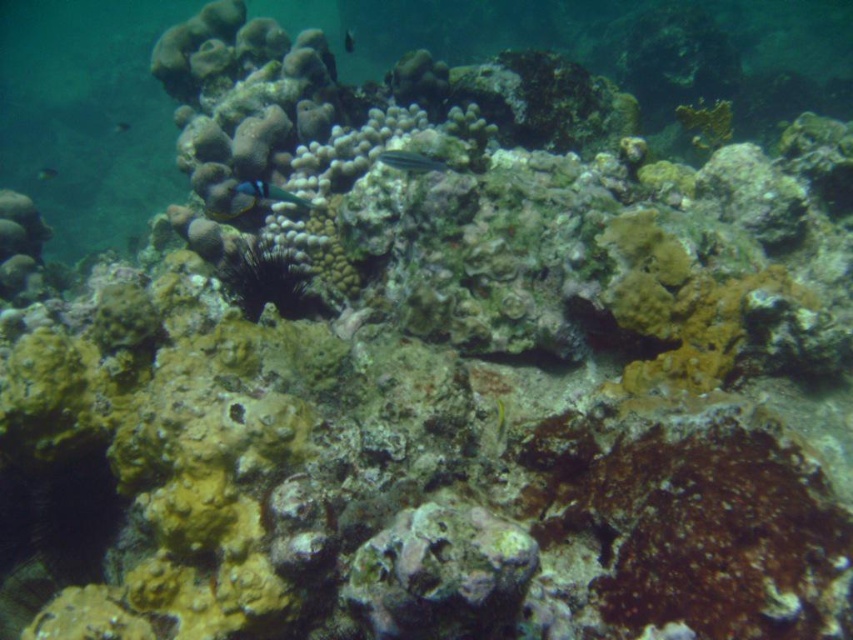
Question: Can you confirm if blue glossy fish at center is positioned above shiny blue fish at left?

Choices:
 (A) no
 (B) yes

Answer: (A)

Question: Which is nearer to the blue glossy fish at center?

Choices:
 (A) green striped fish at center
 (B) shiny blue fish at upper center

Answer: (A)

Question: Can you confirm if blue glossy fish at center is positioned below shiny blue fish at left?

Choices:
 (A) yes
 (B) no

Answer: (A)

Question: Does shiny blue fish at upper center appear on the left side of shiny blue fish at left?

Choices:
 (A) yes
 (B) no

Answer: (B)

Question: Which point is farther from the camera taking this photo?

Choices:
 (A) (434, 166)
 (B) (45, 166)
 (C) (347, 40)
 (D) (254, 202)

Answer: (B)

Question: Which point appears closest to the camera in this image?

Choices:
 (A) (x=410, y=160)
 (B) (x=345, y=29)

Answer: (A)